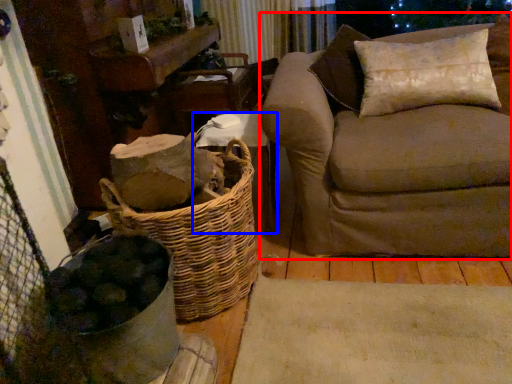
Question: Which of the following is the farthest to the observer, studio couch (highlighted by a red box) or furniture (highlighted by a blue box)?

Choices:
 (A) studio couch
 (B) furniture

Answer: (B)